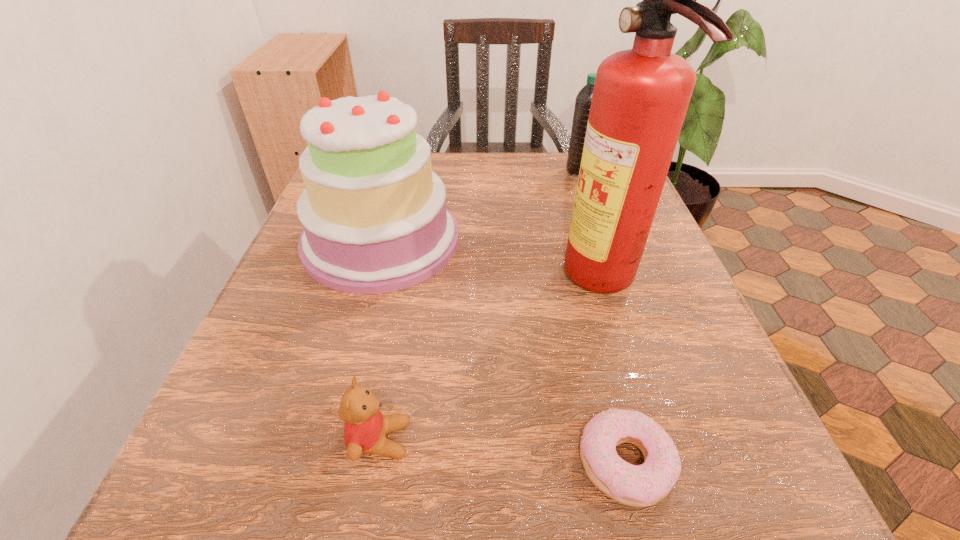
Find the location of a particular element. The height and width of the screenshot is (540, 960). vacant space that's between the farthest object and the teddy bear is located at coordinates tap(480, 306).

Identify the location of vacant point located between the second tallest object and the teddy bear. This screenshot has height=540, width=960. (380, 340).

Image resolution: width=960 pixels, height=540 pixels. Identify the location of vacant region between the second tallest object and the third shortest object. (480, 205).

Where is `vacant space that's between the doughnut and the third shortest object`? The height and width of the screenshot is (540, 960). vacant space that's between the doughnut and the third shortest object is located at coordinates (602, 317).

At what (x,y) coordinates should I click in order to perform the action: click on blank region between the cake and the shortest object. Please return your answer as a coordinate pair (x, y). The image size is (960, 540). Looking at the image, I should click on (503, 352).

Where is `free space between the shortest object and the fourth shortest object`? The width and height of the screenshot is (960, 540). free space between the shortest object and the fourth shortest object is located at coordinates (503, 352).

You are a GUI agent. You are given a task and a screenshot of the screen. Output one action in this format:
    pyautogui.click(x=<x>, y=<y>)
    Task: Click on the free space between the second shortest object and the water bottle
    
    Given the screenshot: What is the action you would take?
    pyautogui.click(x=480, y=306)

I want to click on empty location between the teddy bear and the fire extinguisher, so pos(492,361).

Locate an element on the screen. The height and width of the screenshot is (540, 960). object that is the closest to the doughnut is located at coordinates (641, 95).

This screenshot has height=540, width=960. Find the location of `the fourth closest object to the water bottle`. the fourth closest object to the water bottle is located at coordinates (365, 429).